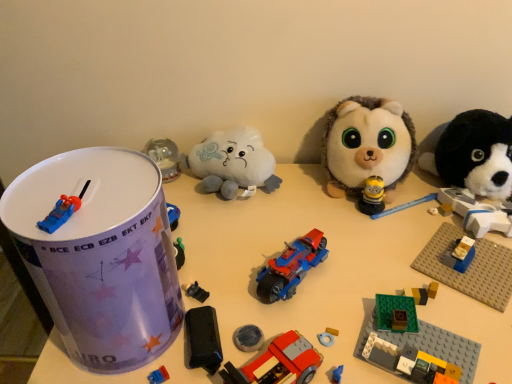
Where is `vacant space to the left of shiny plastic motorcycle at center, the 4th toy viewed from the right`? The width and height of the screenshot is (512, 384). vacant space to the left of shiny plastic motorcycle at center, the 4th toy viewed from the right is located at coordinates (209, 269).